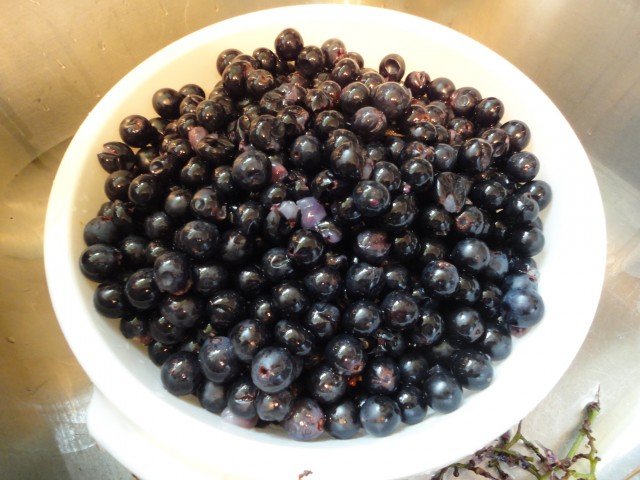
Identify the location of wall to the right of bowl. (560, 45).